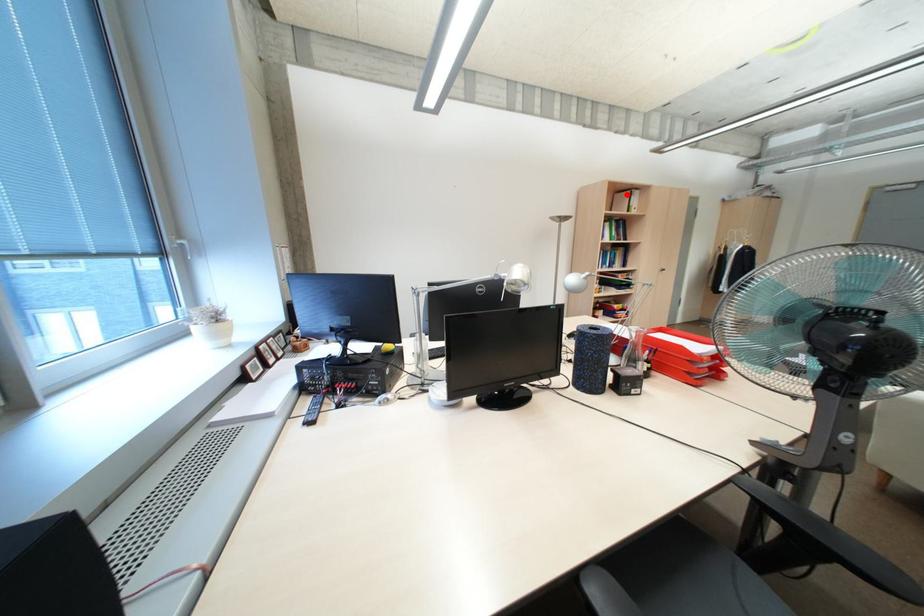
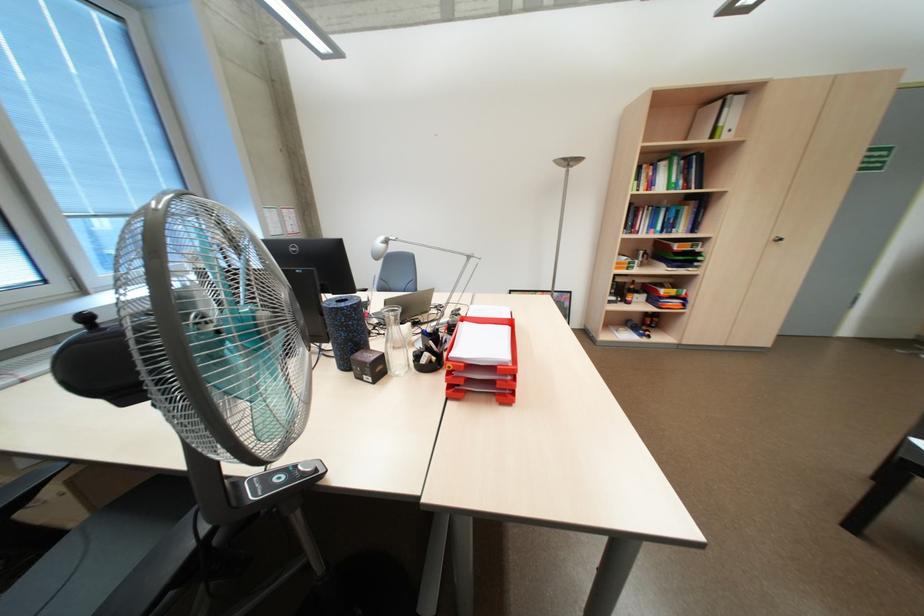
Question: A red point is marked in image1. In image2, is the corresponding 3D point closer to the camera or farther? Reply with the corresponding letter.

Choices:
 (A) The corresponding 3D point is closer.
 (B) The corresponding 3D point is farther.

Answer: (B)